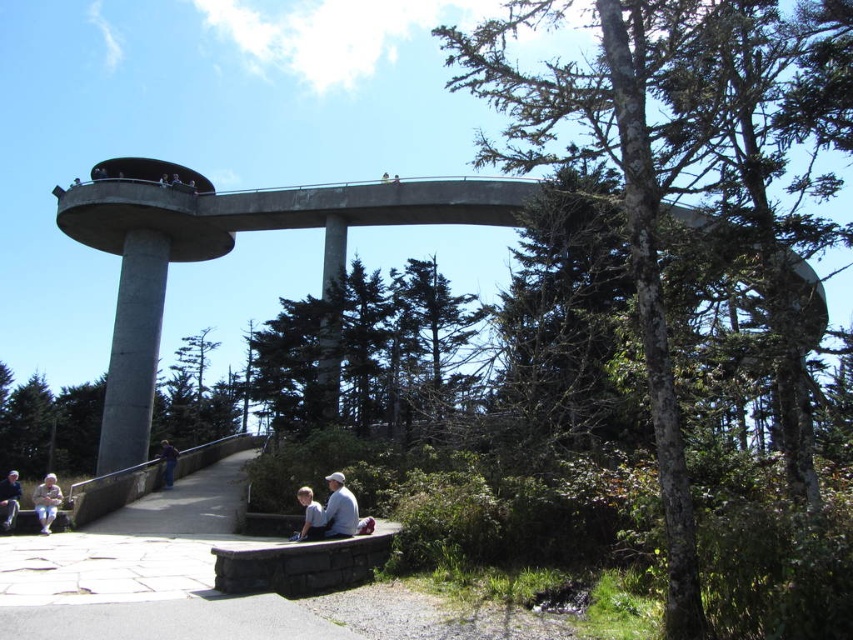
Who is more distant from viewer, (x=351, y=515) or (x=9, y=515)?

The point (x=9, y=515) is behind.

Does gray fabric shirt at lower center have a lesser width compared to light brown leather jacket at lower left?

Yes.

This screenshot has height=640, width=853. I want to click on gray fabric shirt at lower center, so click(339, 508).

At what (x,y) coordinates should I click in order to perform the action: click on gray fabric shirt at lower center. Please return your answer as a coordinate pair (x, y). The image size is (853, 640). Looking at the image, I should click on (x=339, y=508).

Is point (306, 513) behind point (167, 476)?

No, (306, 513) is closer to viewer.

Is point (306, 522) positioned in front of point (164, 440)?

Yes, it is in front of point (164, 440).

The width and height of the screenshot is (853, 640). Find the location of `light blue shirt at lower center`. light blue shirt at lower center is located at coordinates (309, 515).

Between green leafy tree at upper center and light blue denim jacket at lower center, which one appears on the left side from the viewer's perspective?

light blue denim jacket at lower center is more to the left.

At what (x,y) coordinates should I click in order to perform the action: click on green leafy tree at upper center. Please return your answer as a coordinate pair (x, y). Looking at the image, I should click on (665, 189).